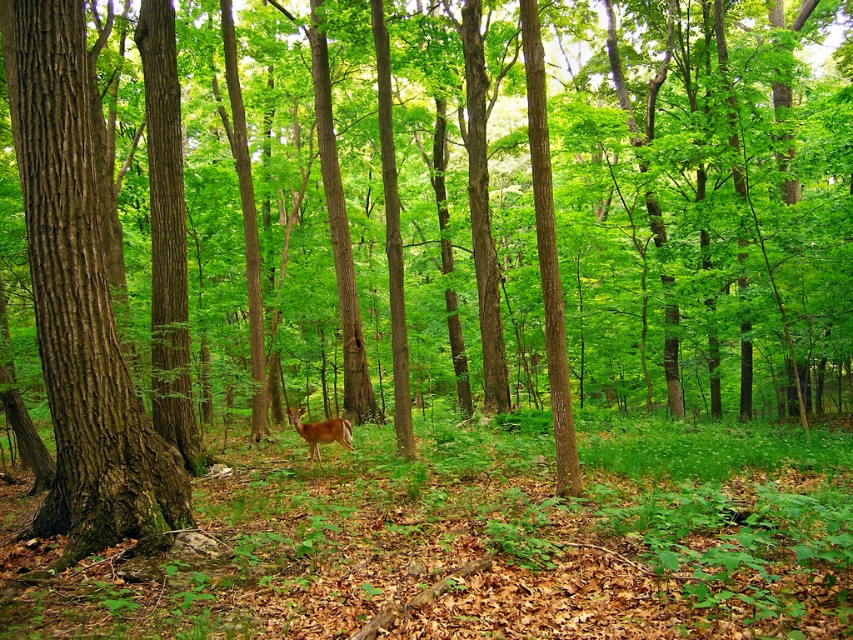
Who is more distant from viewer, [85,108] or [297,422]?

Positioned behind is point [297,422].

Who is more forward, (125, 532) or (328, 422)?

Point (125, 532) is in front.

I want to click on brown textured bark at left, so click(78, 300).